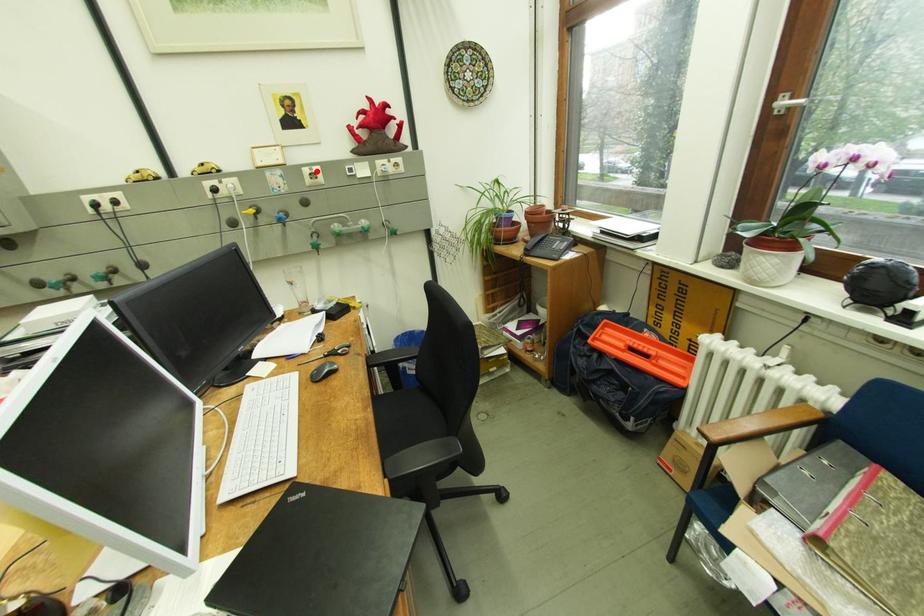
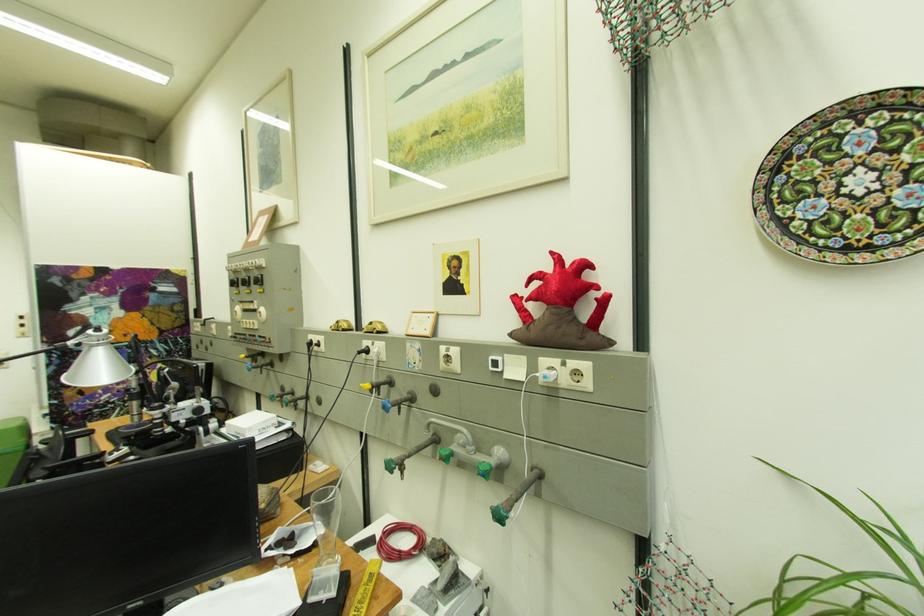
In the second image, find the point that corresponds to the highlighted location in the first image.

(454, 351)